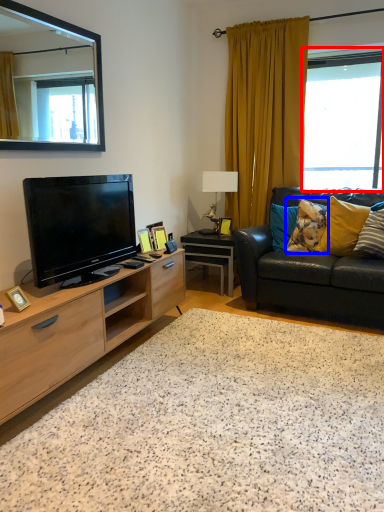
Question: Among these objects, which one is farthest to the camera, window (highlighted by a red box) or pillow (highlighted by a blue box)?

Choices:
 (A) window
 (B) pillow

Answer: (A)